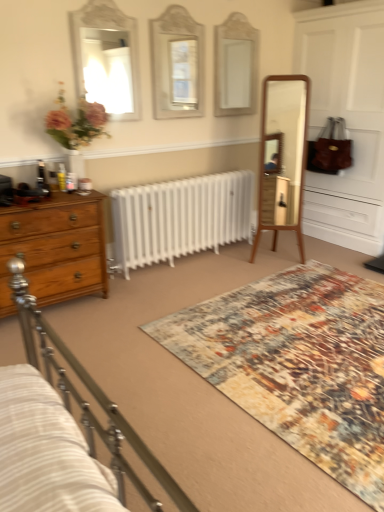
I want to click on vacant space underneath white glossy mirror at upper left, acting as the third mirror starting from the right (from a real-world perspective), so click(x=109, y=144).